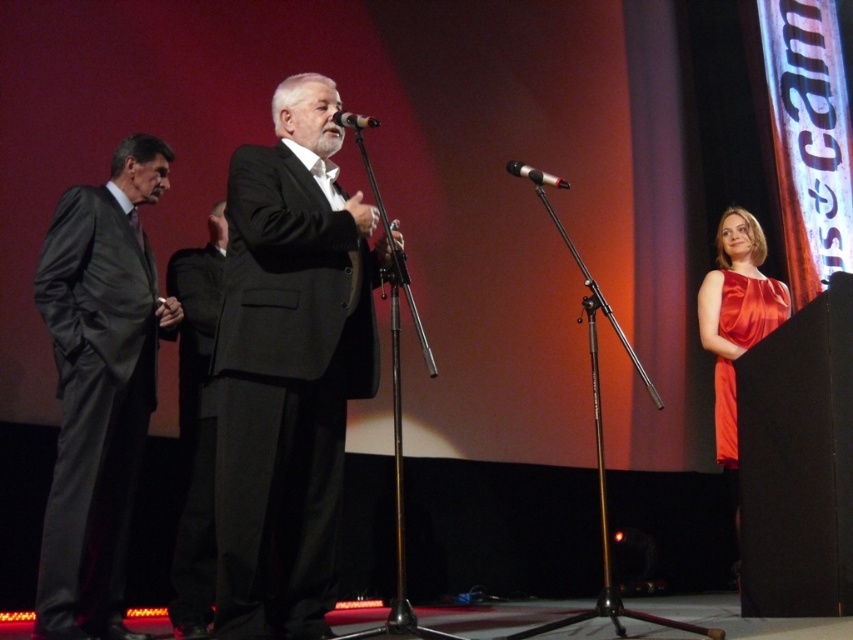
You are an event organizer who needs to ensure all items on stage are visible to the audience. Given that the satin red dress at right and the metallic silver microphone at center are both on the stage, which item might be more noticeable to the audience based on their size?

The satin red dress at right is larger in size than the metallic silver microphone at center, so it would likely be more noticeable to the audience.

In the scene shown: Based on the scene description, where is the matte black suit at center located in the image?

The matte black suit at center is located at point (288, 368).

You are an event organizer and need to place a new chair for a guest. The existing satin red dress at right is located at coordinates point 0.481, 0.880. Can you place the new chair at point 0.5, 0.9 without overlapping?

The satin red dress at right is located at point (750,307). The new chair at point (767,320) is very close but slightly above and to the right. Since the coordinates are distinct, the chair can be placed there without overlapping.